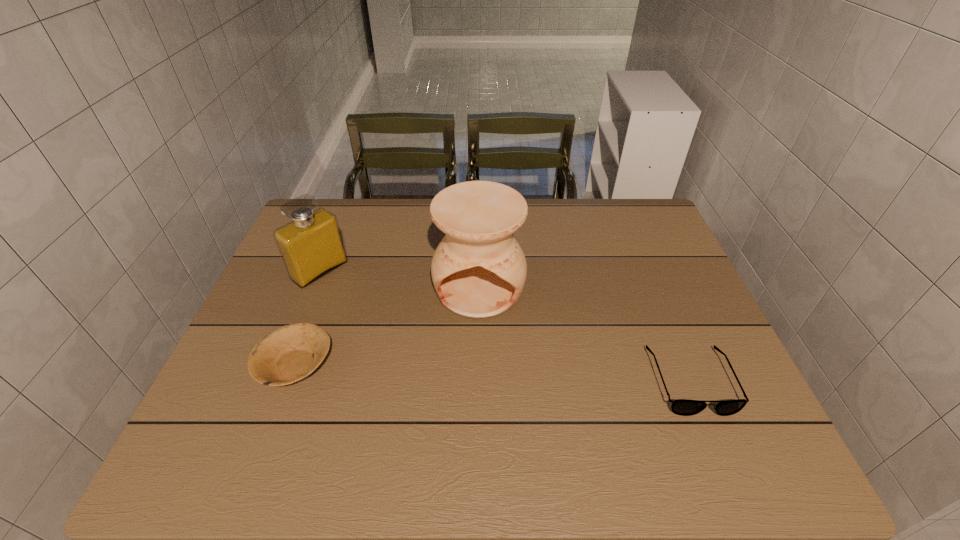
The image size is (960, 540). Find the location of `vacant space that is in between the rightmost object and the bowl`. vacant space that is in between the rightmost object and the bowl is located at coordinates (493, 374).

Where is `free space between the second object from right to left and the bowl`? This screenshot has width=960, height=540. free space between the second object from right to left and the bowl is located at coordinates (387, 327).

Find the location of `vacant space that's between the pottery and the perfume`. vacant space that's between the pottery and the perfume is located at coordinates (399, 279).

Locate an element on the screen. The width and height of the screenshot is (960, 540). vacant area that lies between the bowl and the perfume is located at coordinates (308, 318).

This screenshot has height=540, width=960. Find the location of `object that is the second closest to the perfume`. object that is the second closest to the perfume is located at coordinates (478, 270).

The width and height of the screenshot is (960, 540). Identify the location of object that ranks as the second closest to the perfume. (478, 270).